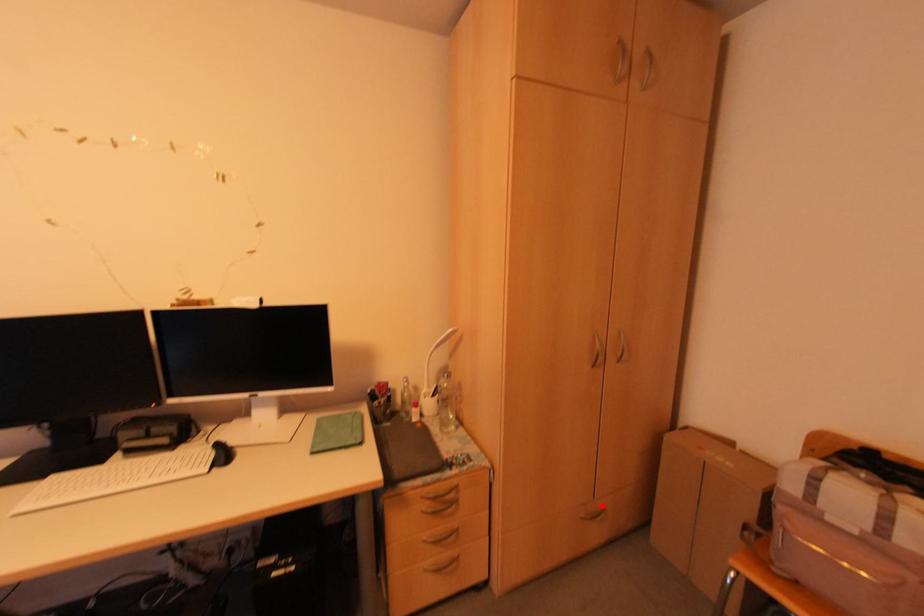
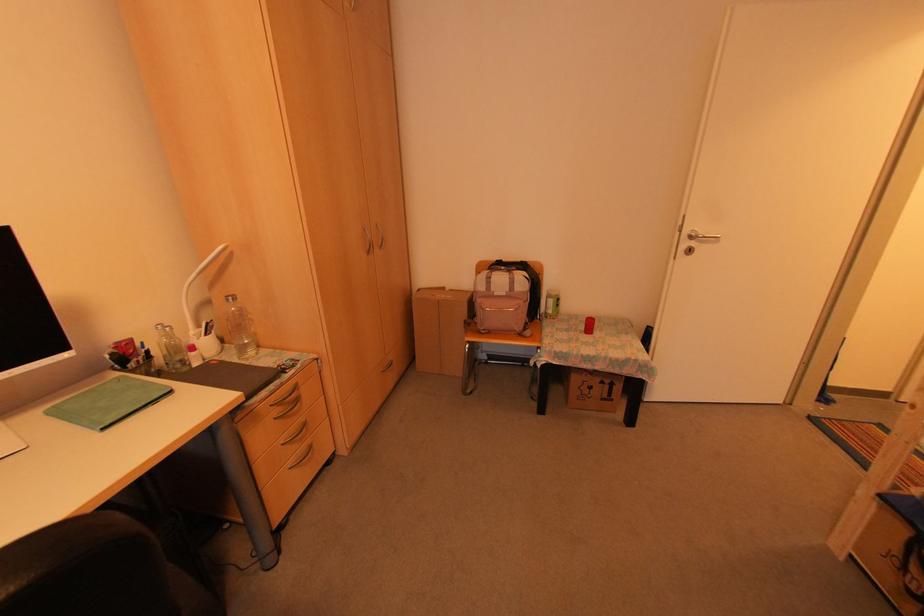
Question: I am providing you with two images of the same scene from different viewpoints. A red point is shown in image1. For the corresponding object point in image2, is it positioned nearer or farther from the camera?

Choices:
 (A) Nearer
 (B) Farther

Answer: (A)